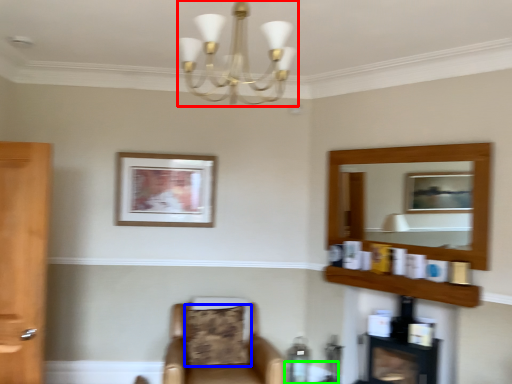
Question: Which is farther away from light fixture (highlighted by a red box)? pillow (highlighted by a blue box) or round table (highlighted by a green box)?

Choices:
 (A) pillow
 (B) round table

Answer: (B)